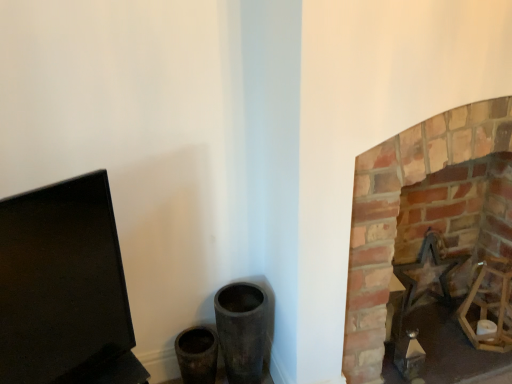
The height and width of the screenshot is (384, 512). Describe the element at coordinates (428, 271) in the screenshot. I see `metallic star at right` at that location.

You are a GUI agent. You are given a task and a screenshot of the screen. Output one action in this format:
    pyautogui.click(x=<x>, y=<y>)
    Task: Click on the black matte computer monitor at left
    The image size is (512, 384).
    Given the screenshot: What is the action you would take?
    pyautogui.click(x=64, y=288)

Where is `brick fireplace at right`? brick fireplace at right is located at coordinates (398, 213).

From a real-world perspective, is black matte computer monitor at left physically below brick fireplace at right?

Incorrect, from a real-world perspective, black matte computer monitor at left is higher than brick fireplace at right.

Considering the sizes of objects black matte computer monitor at left and brick fireplace at right in the image provided, who is smaller, black matte computer monitor at left or brick fireplace at right?

black matte computer monitor at left.

Are brick fireplace at right and black matte computer monitor at left making contact?

No, brick fireplace at right is not beside black matte computer monitor at left.

Can you tell me how much brick fireplace at right and black matte computer monitor at left differ in facing direction?

The facing directions of brick fireplace at right and black matte computer monitor at left are 31.4 degrees apart.

Considering the relative positions of brick fireplace at right and black matte computer monitor at left in the image provided, is brick fireplace at right in front of black matte computer monitor at left?

No, it is not.

Can you confirm if brick fireplace at right is thinner than black matte computer monitor at left?

No, brick fireplace at right is not thinner than black matte computer monitor at left.

How much distance is there between black matte computer monitor at left and metallic star at right?

black matte computer monitor at left and metallic star at right are 4.58 feet apart from each other.

Which is correct: black matte computer monitor at left is inside metallic star at right, or outside of it?

black matte computer monitor at left cannot be found inside metallic star at right.

Is black matte computer monitor at left wider or thinner than metallic star at right?

Considering their sizes, black matte computer monitor at left looks broader than metallic star at right.

Is black matte computer monitor at left not near metallic star at right?

Yes.

Considering the sizes of objects brick fireplace at right and metallic star at right in the image provided, who is shorter, brick fireplace at right or metallic star at right?

With less height is metallic star at right.

Is brick fireplace at right closer to the viewer compared to metallic star at right?

Yes, it is.

Does point (369, 370) come in front of point (416, 264)?

Yes.

Which of these two, brick fireplace at right or metallic star at right, is smaller?

With smaller size is metallic star at right.

What's the angular difference between metallic star at right and black matte computer monitor at left's facing directions?

32.4 degrees.

Is metallic star at right taller than black matte computer monitor at left?

Incorrect, the height of metallic star at right is not larger of that of black matte computer monitor at left.

Is metallic star at right in front of black matte computer monitor at left?

No, the depth of metallic star at right is greater than that of black matte computer monitor at left.

Does point (411, 279) come farther from viewer compared to point (425, 133)?

Yes.

Consider the image. Considering the sizes of objects metallic star at right and brick fireplace at right in the image provided, who is smaller, metallic star at right or brick fireplace at right?

With smaller size is metallic star at right.

From the picture: From a real-world perspective, is metallic star at right positioned over brick fireplace at right based on gravity?

No, from a real-world perspective, metallic star at right is not over brick fireplace at right

The height and width of the screenshot is (384, 512). I want to click on computer monitor in front of the brick fireplace at right, so click(x=64, y=288).

You are a GUI agent. You are given a task and a screenshot of the screen. Output one action in this format:
    pyautogui.click(x=<x>, y=<y>)
    Task: Click on the fireplace behind the black matte computer monitor at left
    This screenshot has width=512, height=384.
    Given the screenshot: What is the action you would take?
    pyautogui.click(x=398, y=213)

Which object lies further to the anchor point brick fireplace at right, metallic star at right or black matte computer monitor at left?

The object further to brick fireplace at right is black matte computer monitor at left.

When comparing their distances from metallic star at right, does black matte computer monitor at left or brick fireplace at right seem further?

black matte computer monitor at left is further to metallic star at right.

Which object lies nearer to the anchor point black matte computer monitor at left, metallic star at right or brick fireplace at right?

brick fireplace at right is positioned closer to the anchor black matte computer monitor at left.

From the picture: Based on their spatial positions, is brick fireplace at right or metallic star at right further from black matte computer monitor at left?

The object further to black matte computer monitor at left is metallic star at right.

From the image, which object appears to be farther from brick fireplace at right, black matte computer monitor at left or metallic star at right?

black matte computer monitor at left.

When comparing their distances from metallic star at right, does brick fireplace at right or black matte computer monitor at left seem closer?

brick fireplace at right is closer to metallic star at right.

Find the location of `fireplace between black matte computer monitor at left and metallic star at right in the horizontal direction`. fireplace between black matte computer monitor at left and metallic star at right in the horizontal direction is located at coordinates (398, 213).